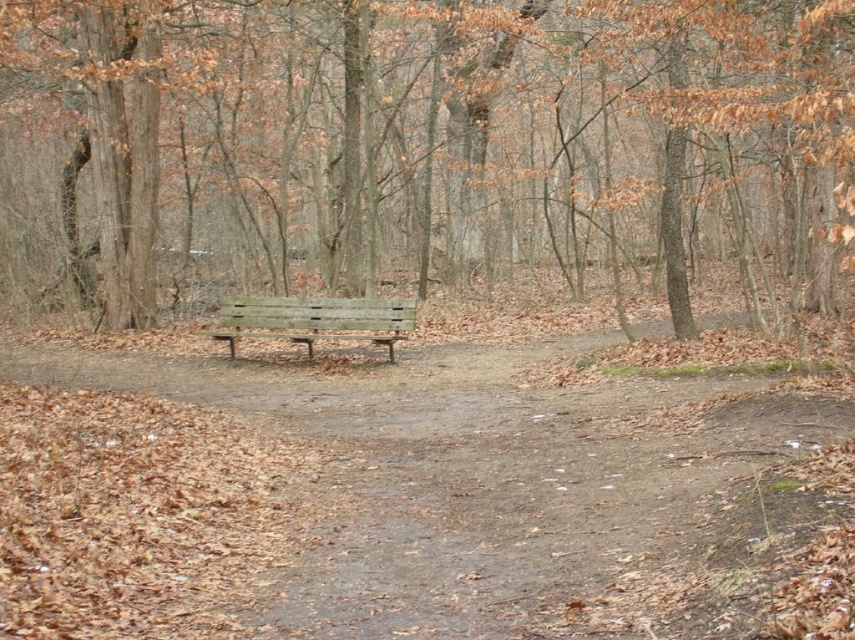
Who is higher up, brown wood bench at center or brown dirt path at center?

Positioned higher is brown wood bench at center.

Can you confirm if brown wood bench at center is smaller than brown dirt path at center?

Actually, brown wood bench at center might be larger than brown dirt path at center.

Who is more forward, (508, 259) or (196, 360)?

Point (196, 360) is more forward.

The height and width of the screenshot is (640, 855). I want to click on brown wood bench at center, so click(429, 141).

Is brown wood bench at center bigger than weathered wood bench at center?

Yes.

Can you confirm if brown wood bench at center is positioned to the left of weathered wood bench at center?

Incorrect, brown wood bench at center is not on the left side of weathered wood bench at center.

Who is more distant from viewer, (591, 58) or (295, 307)?

Positioned behind is point (591, 58).

Image resolution: width=855 pixels, height=640 pixels. What are the coordinates of `brown wood bench at center` in the screenshot? It's located at (429, 141).

Is brown dirt path at center taller than weathered wood bench at center?

Yes.

Which is more to the right, brown dirt path at center or weathered wood bench at center?

Positioned to the right is brown dirt path at center.

The image size is (855, 640). What do you see at coordinates (479, 474) in the screenshot?
I see `brown dirt path at center` at bounding box center [479, 474].

Where is `brown dirt path at center`? brown dirt path at center is located at coordinates (479, 474).